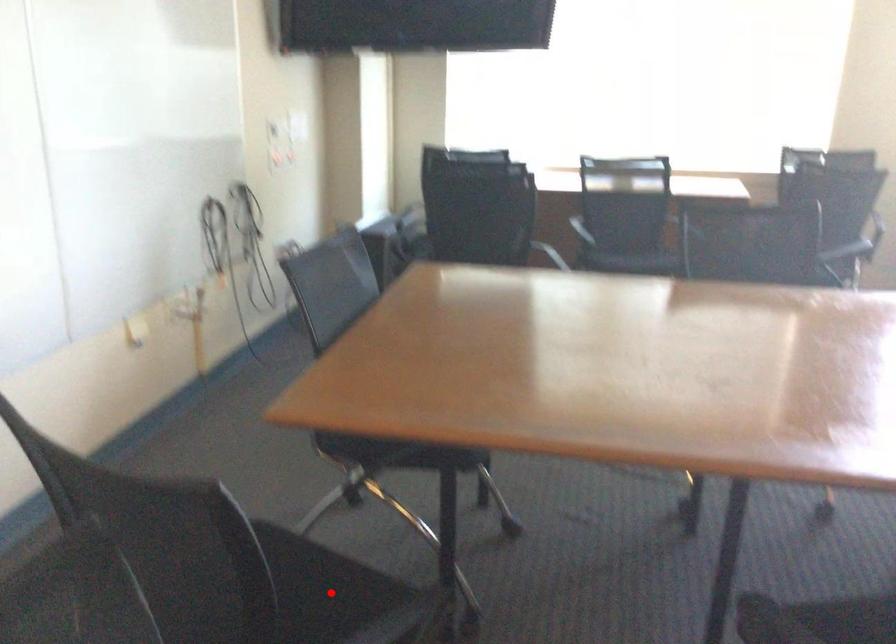
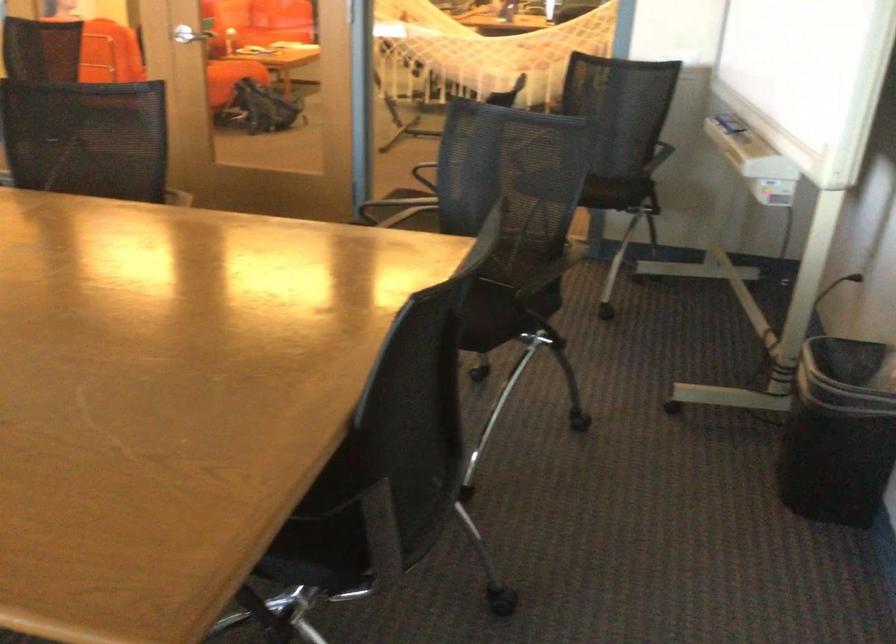
Question: I am providing you with two images of the same scene from different viewpoints. A red point is marked on the first image. Is the red point's position out of view in image 2?

Choices:
 (A) Yes
 (B) No

Answer: (A)